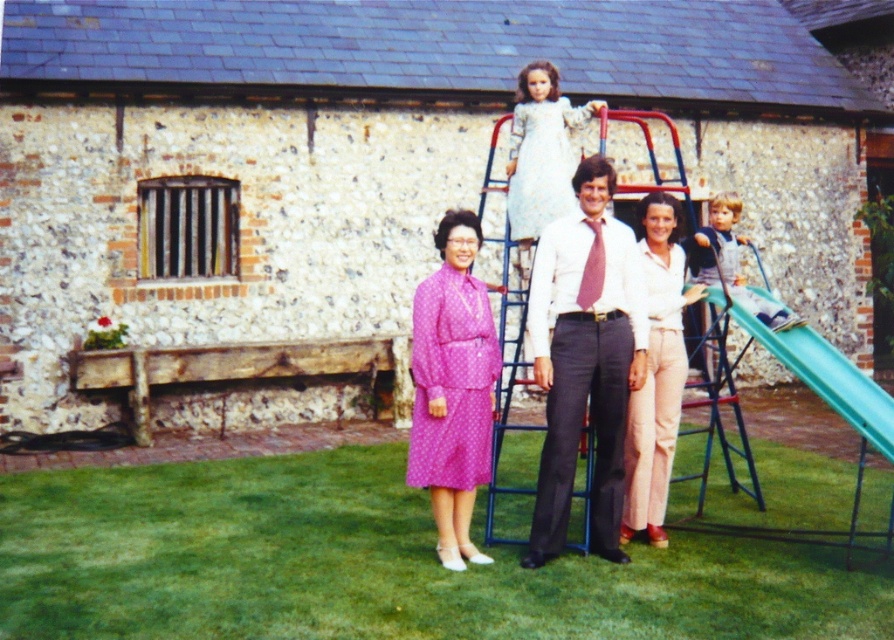
Does matte white shirt at center appear over green plastic slide at right?

Indeed, matte white shirt at center is positioned over green plastic slide at right.

Is matte white shirt at center bigger than green plastic slide at right?

Incorrect, matte white shirt at center is not larger than green plastic slide at right.

Where is `matte white shirt at center`? This screenshot has height=640, width=894. matte white shirt at center is located at coordinates (585, 358).

The image size is (894, 640). I want to click on matte white shirt at center, so click(585, 358).

How distant is pink polka dot dress at center from light brown denim overalls at right?

pink polka dot dress at center and light brown denim overalls at right are 2.29 meters apart.

Which is behind, point (415, 384) or point (720, 253)?

The point (720, 253) is behind.

Identify the location of pink polka dot dress at center. This screenshot has height=640, width=894. click(452, 387).

Is matte white shirt at center wider than light beige cotton pants at center?

Indeed, matte white shirt at center has a greater width compared to light beige cotton pants at center.

Consider the image. Which is more to the right, matte white shirt at center or light beige cotton pants at center?

From the viewer's perspective, light beige cotton pants at center appears more on the right side.

Find the location of a particular element. matte white shirt at center is located at coordinates (585, 358).